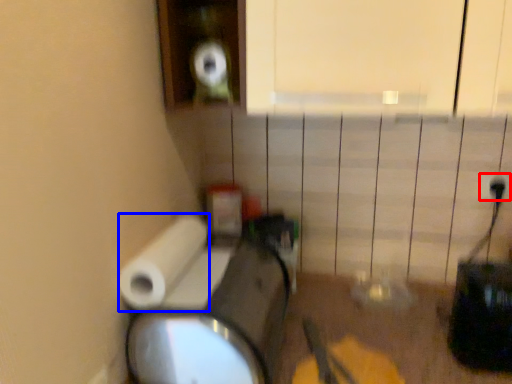
Question: Which point is further to the camera, electric outlet (highlighted by a red box) or toilet paper (highlighted by a blue box)?

Choices:
 (A) electric outlet
 (B) toilet paper

Answer: (A)